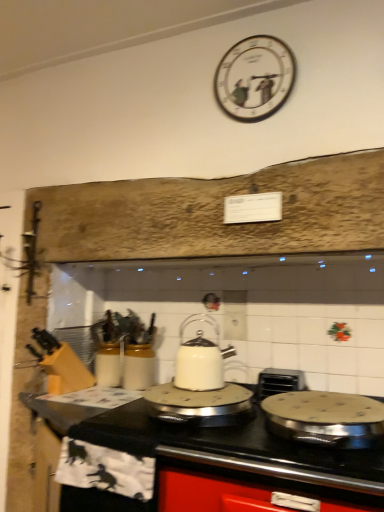
Question: Can you confirm if white painted wood clock at upper center is taller than white glossy kettle at center, the third kitchen appliance positioned from the right?

Choices:
 (A) yes
 (B) no

Answer: (A)

Question: Considering the relative positions of white painted wood clock at upper center and white glossy kettle at center, placed as the 1th kitchen appliance when sorted from left to right, in the image provided, is white painted wood clock at upper center to the left of white glossy kettle at center, placed as the 1th kitchen appliance when sorted from left to right, from the viewer's perspective?

Choices:
 (A) yes
 (B) no

Answer: (B)

Question: From the image's perspective, is white painted wood clock at upper center beneath white glossy kettle at center, the third kitchen appliance positioned from the right?

Choices:
 (A) yes
 (B) no

Answer: (B)

Question: Is the depth of white painted wood clock at upper center greater than that of white glossy kettle at center, the third kitchen appliance positioned from the right?

Choices:
 (A) yes
 (B) no

Answer: (A)

Question: From a real-world perspective, is white painted wood clock at upper center on white glossy kettle at center, the third kitchen appliance positioned from the right?

Choices:
 (A) yes
 (B) no

Answer: (A)

Question: Do you think stainless steel frying pan at center, marked as the first kitchen appliance in a right-to-left arrangement, is within white painted wood clock at upper center, or outside of it?

Choices:
 (A) inside
 (B) outside

Answer: (B)

Question: Does point (375, 401) appear closer or farther from the camera than point (221, 102)?

Choices:
 (A) farther
 (B) closer

Answer: (B)

Question: Based on their sizes in the image, would you say stainless steel frying pan at center, marked as the first kitchen appliance in a right-to-left arrangement, is bigger or smaller than white painted wood clock at upper center?

Choices:
 (A) small
 (B) big

Answer: (B)

Question: From the image's perspective, is stainless steel frying pan at center, which is counted as the third kitchen appliance, starting from the left, positioned above or below white painted wood clock at upper center?

Choices:
 (A) above
 (B) below

Answer: (B)

Question: Relative to white glossy kettle at center, placed as the 1th kitchen appliance when sorted from left to right, is white glossy kettle at center, which is counted as the 2th kitchen appliance, starting from the left, in front or behind?

Choices:
 (A) behind
 (B) front

Answer: (A)

Question: Is point (193, 351) closer or farther from the camera than point (231, 416)?

Choices:
 (A) closer
 (B) farther

Answer: (B)

Question: Considering the positions of white glossy kettle at center, which is counted as the 2th kitchen appliance, starting from the left, and white glossy kettle at center, placed as the 1th kitchen appliance when sorted from left to right, in the image, is white glossy kettle at center, which is counted as the 2th kitchen appliance, starting from the left, wider or thinner than white glossy kettle at center, placed as the 1th kitchen appliance when sorted from left to right,?

Choices:
 (A) thin
 (B) wide

Answer: (A)

Question: Based on their sizes in the image, would you say white glossy kettle at center, which is the second kitchen appliance from right to left, is bigger or smaller than white glossy kettle at center, the third kitchen appliance positioned from the right?

Choices:
 (A) big
 (B) small

Answer: (B)

Question: From a real-world perspective, relative to white painted wood clock at upper center, is white glossy countertop at center vertically above or below?

Choices:
 (A) above
 (B) below

Answer: (B)

Question: Would you say white glossy countertop at center is inside or outside white painted wood clock at upper center?

Choices:
 (A) inside
 (B) outside

Answer: (B)